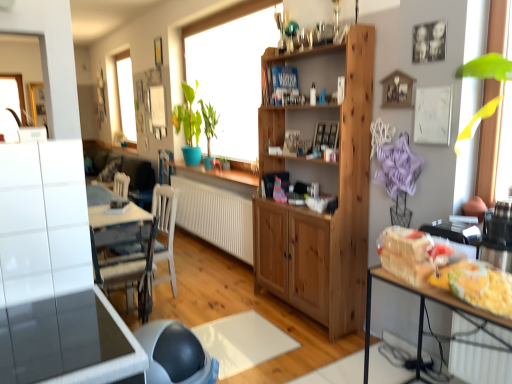
Question: Considering their positions, is yellow matte cheese at lower right, which ranks as the 2th food in top-to-bottom order, located in front of or behind natural wood cabinet at center?

Choices:
 (A) front
 (B) behind

Answer: (A)

Question: Based on their positions, is yellow matte cheese at lower right, which appears as the first food when ordered from the bottom, located to the left or right of natural wood cabinet at center?

Choices:
 (A) left
 (B) right

Answer: (B)

Question: Which of these objects is positioned farthest from the natural wood cabinet at center?

Choices:
 (A) wooden table at right, the 2th table positioned from the front
 (B) translucent plastic bag at right, which appears as the first food when viewed from the top
 (C) yellow matte cheese at lower right, which ranks as the 2th food in top-to-bottom order
 (D) glossy white table at lower left, the second table from the right
 (E) white textured radiator at center

Answer: (D)

Question: Estimate the real-world distances between objects in this image. Which object is farther from the white textured radiator at center?

Choices:
 (A) glossy white table at lower left, the second table viewed from the back
 (B) green glossy plant at center
 (C) translucent plastic bag at right, which appears as the first food when viewed from the top
 (D) natural wood cabinet at center
 (E) white matte chair at center

Answer: (A)